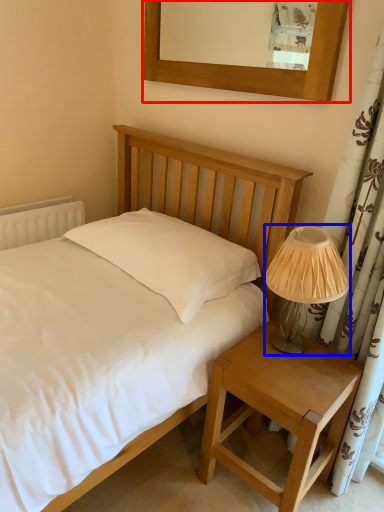
Question: Which object appears closest to the camera in this image, picture frame (highlighted by a red box) or table lamp (highlighted by a blue box)?

Choices:
 (A) picture frame
 (B) table lamp

Answer: (B)